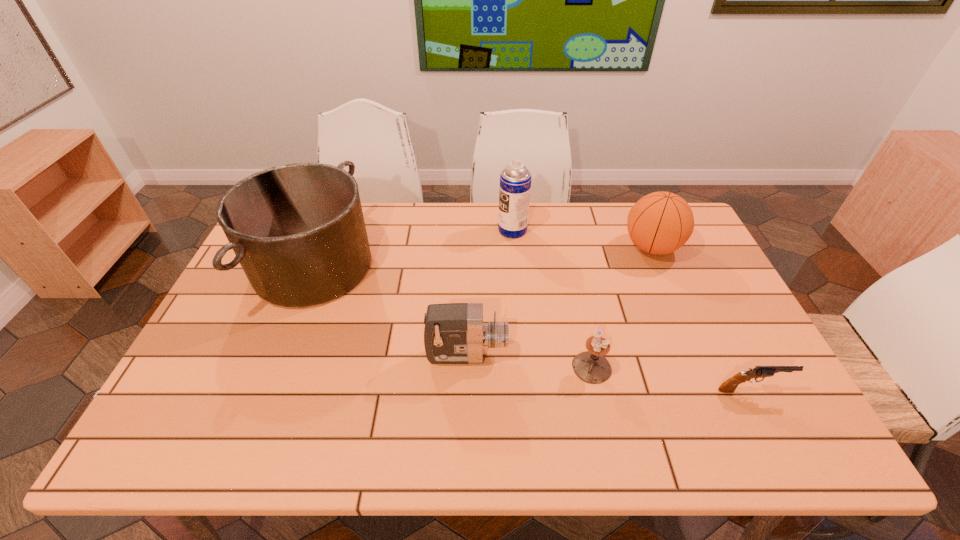
I want to click on gun at the right edge, so click(729, 386).

Image resolution: width=960 pixels, height=540 pixels. I want to click on object at the far left corner, so click(298, 231).

Find the location of a particular element. The width and height of the screenshot is (960, 540). object located in the far right corner section of the desktop is located at coordinates (659, 223).

In the image, there is a desktop. What are the coordinates of `free space at the far edge` in the screenshot? It's located at (494, 218).

Image resolution: width=960 pixels, height=540 pixels. Find the location of `free space at the near edge`. free space at the near edge is located at coordinates (658, 450).

In the image, there is a desktop. Identify the location of free region at the left edge. The width and height of the screenshot is (960, 540). (266, 320).

Where is `vacant space at the right edge of the desktop`? This screenshot has width=960, height=540. vacant space at the right edge of the desktop is located at coordinates (728, 370).

This screenshot has height=540, width=960. Identify the location of vacant space at the near right corner of the desktop. (770, 430).

The height and width of the screenshot is (540, 960). I want to click on vacant area between the second shortest object and the camcorder, so click(529, 361).

This screenshot has width=960, height=540. I want to click on free space that is in between the nearest object and the aerosol can, so click(x=632, y=310).